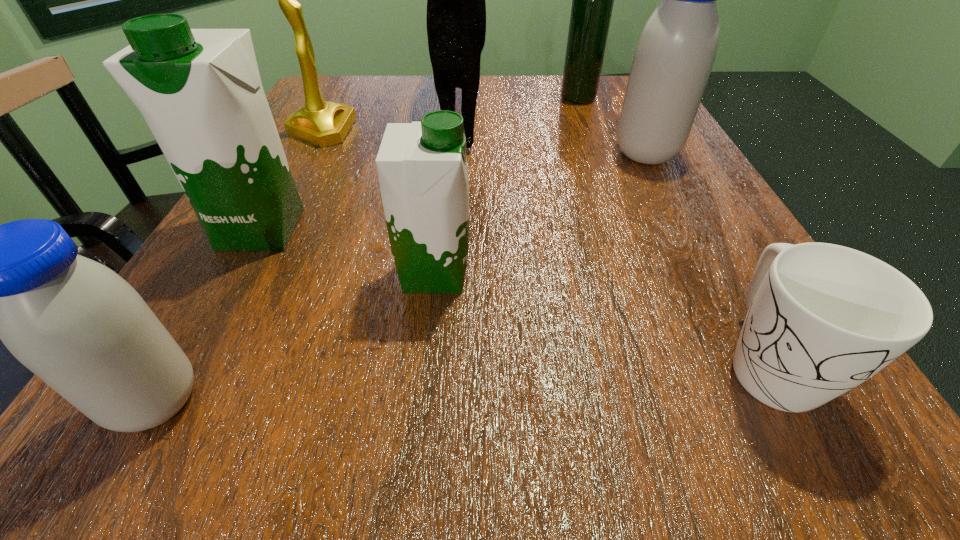
You are a GUI agent. You are given a task and a screenshot of the screen. Output one action in this format:
    pyautogui.click(x=<x>, y=<y>)
    Task: Click on the shortest object
    
    Given the screenshot: What is the action you would take?
    pyautogui.click(x=822, y=318)

Where is `vacant space located 0.270m on the face of the black cat`? vacant space located 0.270m on the face of the black cat is located at coordinates tap(450, 275).

This screenshot has height=540, width=960. Find the location of `free space located on the front of the liquor`. free space located on the front of the liquor is located at coordinates (587, 120).

This screenshot has width=960, height=540. In order to click on vacant space located on the front-facing side of the golden award in this screenshot , I will do `click(396, 131)`.

Find the location of a particular element. free space located on the back of the rightmost soya milk is located at coordinates (630, 122).

Identify the location of vacant point located on the front-facing side of the left green soya milk. The width and height of the screenshot is (960, 540). [x=183, y=370].

Find the location of a particular element. This screenshot has height=540, width=960. free space located 0.280m on the front-facing side of the smaller green soya milk is located at coordinates [x=671, y=273].

The width and height of the screenshot is (960, 540). I want to click on vacant space located 0.390m on the back of the smaller blue soya milk, so click(x=284, y=179).

Identify the location of cat positioned at the far edge. (456, 9).

The width and height of the screenshot is (960, 540). I want to click on liquor that is at the far edge, so click(x=592, y=0).